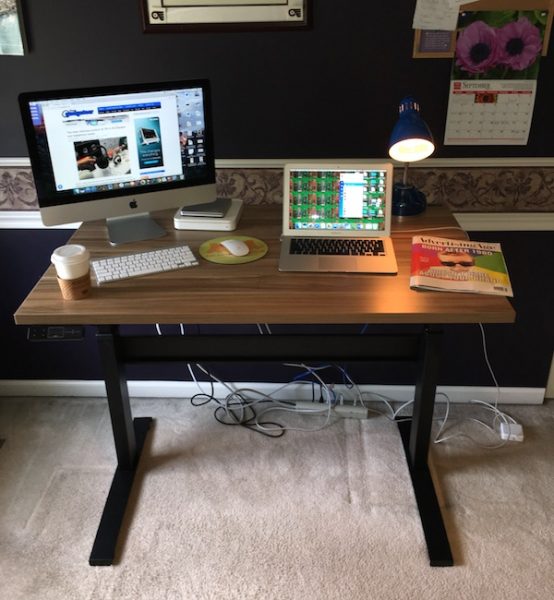
Where is `pictures`? pictures is located at coordinates (217, 25).